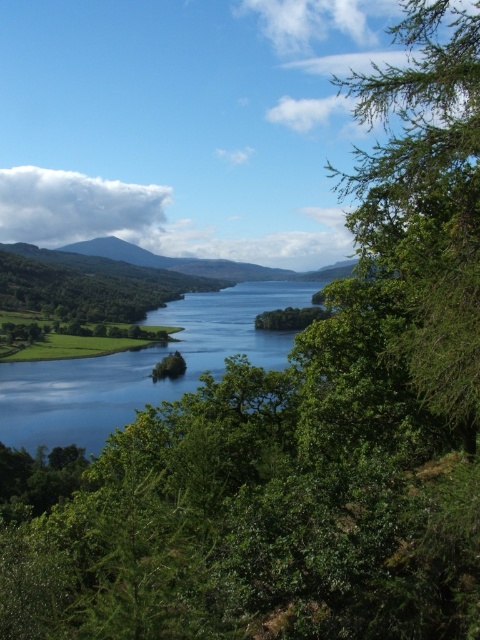
You are standing at the point marked as point [427,200] in the image. What do you see around you?

You are surrounded by green needle like leaves at right.

You are standing at the point closest to the camera in the image. Which point, point (439,141) or point (207,305), is closer to you?

Point (439,141) is closer to the camera than point (207,305), so it is closer to you.